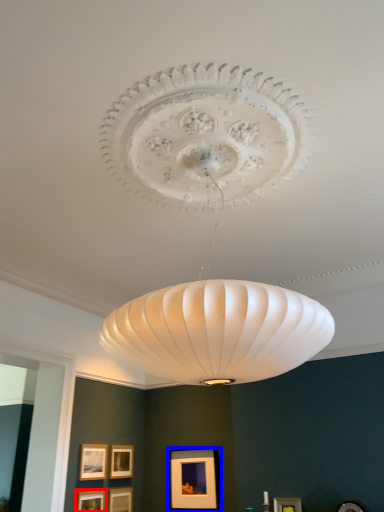
Question: Which of the following is the closest to the observer, picture frame (highlighted by a red box) or picture frame (highlighted by a blue box)?

Choices:
 (A) picture frame
 (B) picture frame

Answer: (A)